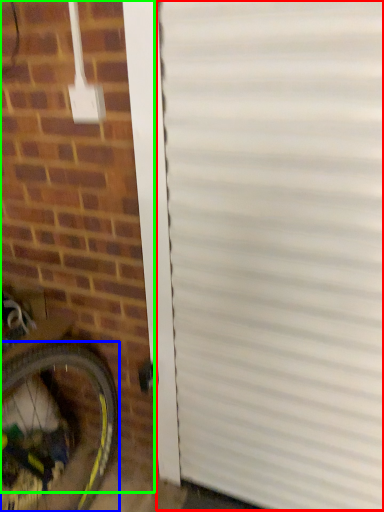
Question: Based on their relative distances, which object is farther from garage door (highlighted by a red box)? Choose from bicycle wheel (highlighted by a blue box) and brickwork (highlighted by a green box).

Choices:
 (A) bicycle wheel
 (B) brickwork

Answer: (A)